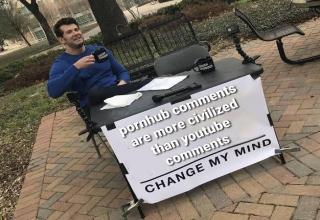
The width and height of the screenshot is (320, 220). Find the location of `desks`. desks is located at coordinates (224, 77).